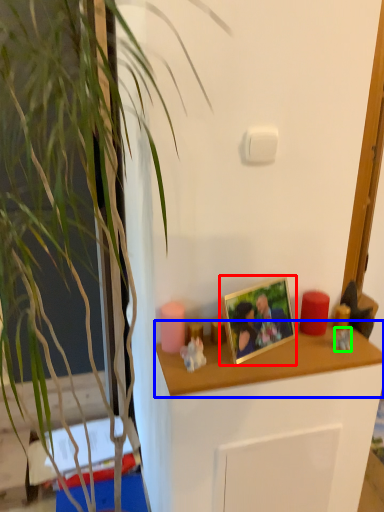
Question: Considering the real-world distances, which object is farthest from picture frame (highlighted by a red box)? desk (highlighted by a blue box) or toy (highlighted by a green box)?

Choices:
 (A) desk
 (B) toy

Answer: (B)